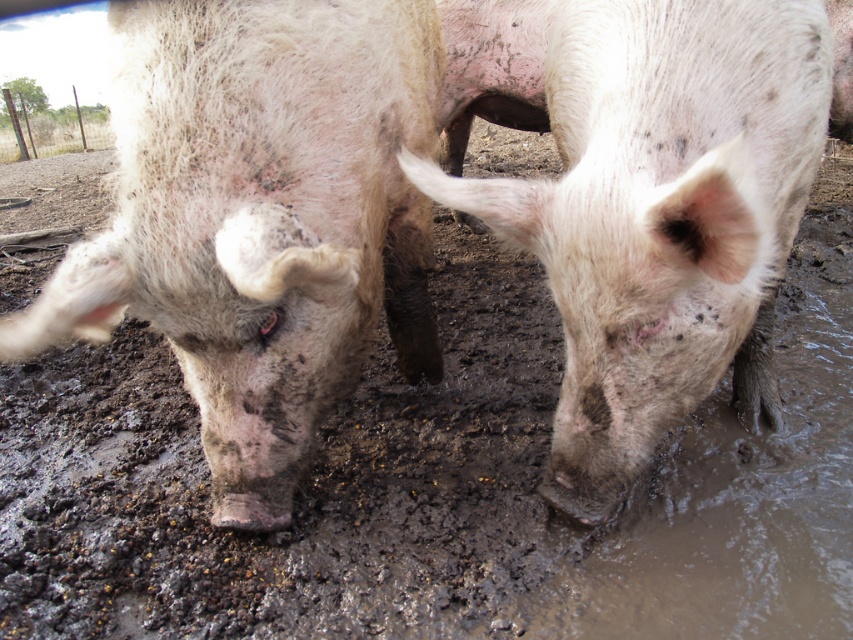
Is point (238, 289) positioned behind point (618, 433)?

No, (238, 289) is in front of (618, 433).

Is dirty pink skin at center to the right of speckled muddy pig at center from the viewer's perspective?

In fact, dirty pink skin at center is to the left of speckled muddy pig at center.

The width and height of the screenshot is (853, 640). What do you see at coordinates (260, 218) in the screenshot? I see `dirty pink skin at center` at bounding box center [260, 218].

You are a GUI agent. You are given a task and a screenshot of the screen. Output one action in this format:
    pyautogui.click(x=<x>, y=<y>)
    Task: Click on the dirty pink skin at center
    Image resolution: width=853 pixels, height=640 pixels.
    Given the screenshot: What is the action you would take?
    pyautogui.click(x=260, y=218)